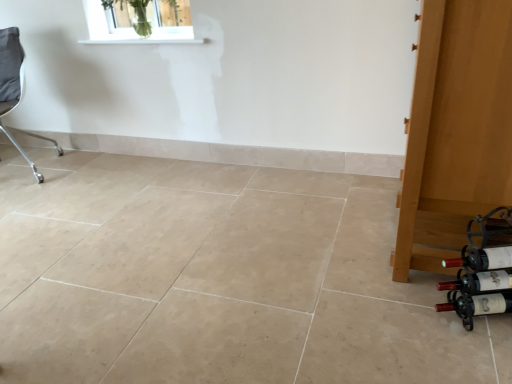
Image resolution: width=512 pixels, height=384 pixels. Describe the element at coordinates (455, 131) in the screenshot. I see `wooden door at right` at that location.

The image size is (512, 384). What do you see at coordinates (480, 281) in the screenshot?
I see `matte glass wine bottle at lower right, the 3th wine bottle in the top-to-bottom sequence` at bounding box center [480, 281].

The width and height of the screenshot is (512, 384). Find the location of `gray fabric chair at left`. gray fabric chair at left is located at coordinates (16, 91).

What do you see at coordinates (16, 91) in the screenshot? I see `gray fabric chair at left` at bounding box center [16, 91].

What do you see at coordinates (482, 258) in the screenshot? The height and width of the screenshot is (384, 512). I see `matte black wine bottle at lower right, which is the 4th wine bottle in bottom-to-top order` at bounding box center [482, 258].

What is the approximate height of white smooth window sill at upper center?

The height of white smooth window sill at upper center is 3.47 centimeters.

I want to click on white smooth window sill at upper center, so click(x=144, y=41).

Measure the distance between matte glass wine bottle at lower right, the 3th wine bottle from the bottom, and camera.

matte glass wine bottle at lower right, the 3th wine bottle from the bottom, and camera are 4.34 feet apart.

The height and width of the screenshot is (384, 512). What do you see at coordinates (477, 304) in the screenshot?
I see `matte glass wine bottle at lower right, which is counted as the first wine bottle, starting from the bottom` at bounding box center [477, 304].

At what (x,y) coordinates should I click in order to perform the action: click on clear glass vase at upper center. Please return your answer as a coordinate pair (x, y). The height and width of the screenshot is (384, 512). Looking at the image, I should click on (139, 23).

Identify the location of wooden door at right. Image resolution: width=512 pixels, height=384 pixels. 455,131.

Which of these two, matte glass wine bottle at lower right, the 4th wine bottle in the top-to-bottom sequence, or white smooth window sill at upper center, stands taller?

matte glass wine bottle at lower right, the 4th wine bottle in the top-to-bottom sequence.

Is matte glass wine bottle at lower right, the 4th wine bottle in the top-to-bottom sequence, positioned in front of white smooth window sill at upper center?

Yes, matte glass wine bottle at lower right, the 4th wine bottle in the top-to-bottom sequence, is in front of white smooth window sill at upper center.

Does matte glass wine bottle at lower right, which is counted as the first wine bottle, starting from the bottom, have a larger size compared to white smooth window sill at upper center?

Actually, matte glass wine bottle at lower right, which is counted as the first wine bottle, starting from the bottom, might be smaller than white smooth window sill at upper center.

From the image's perspective, is matte glass wine bottle at lower right, which is counted as the first wine bottle, starting from the bottom, on white smooth window sill at upper center?

No.

Is white smooth window sill at upper center beside matte black wine bottle at lower right, which is the 4th wine bottle in bottom-to-top order?

No.

Looking at this image, which object is further away from the camera, white smooth window sill at upper center or matte black wine bottle at lower right, which is the first wine bottle from top to bottom?

Positioned behind is white smooth window sill at upper center.

Which of these two, white smooth window sill at upper center or matte black wine bottle at lower right, which is the first wine bottle from top to bottom, is bigger?

With larger size is white smooth window sill at upper center.

What are the coordinates of `the 2nd wine bottle counting from the right of the white smooth window sill at upper center` in the screenshot? It's located at (482, 258).

Which is behind, matte glass wine bottle at lower right, the 2th wine bottle positioned from the bottom, or gray fabric chair at left?

gray fabric chair at left is more distant.

Is matte glass wine bottle at lower right, the 3th wine bottle in the top-to-bottom sequence, aimed at gray fabric chair at left?

No, matte glass wine bottle at lower right, the 3th wine bottle in the top-to-bottom sequence, does not turn towards gray fabric chair at left.

In the image, is matte glass wine bottle at lower right, the 3th wine bottle in the top-to-bottom sequence, on the left side or the right side of gray fabric chair at left?

Result: From the image, it's evident that matte glass wine bottle at lower right, the 3th wine bottle in the top-to-bottom sequence, is to the right of gray fabric chair at left.

Between matte glass wine bottle at lower right, the 2th wine bottle positioned from the bottom, and gray fabric chair at left, which one has more height?

gray fabric chair at left.

Could you tell me if gray fabric chair at left is turned towards matte glass wine bottle at lower right, the 3th wine bottle from the bottom?

No, gray fabric chair at left is not facing towards matte glass wine bottle at lower right, the 3th wine bottle from the bottom.

From the image's perspective, does gray fabric chair at left appear higher than matte glass wine bottle at lower right, which is the second wine bottle in top-to-bottom order?

Indeed, from the image's perspective, gray fabric chair at left is shown above matte glass wine bottle at lower right, which is the second wine bottle in top-to-bottom order.

How far apart are gray fabric chair at left and matte glass wine bottle at lower right, which is the second wine bottle in top-to-bottom order?

gray fabric chair at left is 9.50 feet away from matte glass wine bottle at lower right, which is the second wine bottle in top-to-bottom order.

From a real-world perspective, which object stands above the other?

gray fabric chair at left.

Is matte glass wine bottle at lower right, the 3th wine bottle from the bottom, aimed at gray fabric chair at left?

No, matte glass wine bottle at lower right, the 3th wine bottle from the bottom, is not oriented towards gray fabric chair at left.

This screenshot has height=384, width=512. What are the coordinates of `chair that is above the matte glass wine bottle at lower right, the 3th wine bottle from the bottom (from a real-world perspective)` in the screenshot? It's located at (16, 91).

Considering the positions of objects matte glass wine bottle at lower right, the 3th wine bottle from the bottom, and gray fabric chair at left in the image provided, who is more to the right, matte glass wine bottle at lower right, the 3th wine bottle from the bottom, or gray fabric chair at left?

matte glass wine bottle at lower right, the 3th wine bottle from the bottom.

In terms of width, does matte glass wine bottle at lower right, which is the second wine bottle in top-to-bottom order, look wider or thinner when compared to gray fabric chair at left?

matte glass wine bottle at lower right, which is the second wine bottle in top-to-bottom order, is thinner than gray fabric chair at left.

Looking at this image, can you confirm if matte glass wine bottle at lower right, which is counted as the first wine bottle, starting from the bottom, is smaller than gray fabric chair at left?

Yes, matte glass wine bottle at lower right, which is counted as the first wine bottle, starting from the bottom, is smaller than gray fabric chair at left.

From a real-world perspective, between matte glass wine bottle at lower right, which is counted as the first wine bottle, starting from the bottom, and gray fabric chair at left, who is vertically higher?

gray fabric chair at left.

Considering the sizes of objects matte glass wine bottle at lower right, which is counted as the first wine bottle, starting from the bottom, and gray fabric chair at left in the image provided, who is taller, matte glass wine bottle at lower right, which is counted as the first wine bottle, starting from the bottom, or gray fabric chair at left?

gray fabric chair at left.

Which object is further away from the camera, matte glass wine bottle at lower right, which is counted as the first wine bottle, starting from the bottom, or gray fabric chair at left?

gray fabric chair at left is behind.

Is clear glass vase at upper center turned away from matte glass wine bottle at lower right, the 4th wine bottle in the top-to-bottom sequence?

clear glass vase at upper center is not turned away from matte glass wine bottle at lower right, the 4th wine bottle in the top-to-bottom sequence.

From the picture: In the image, is clear glass vase at upper center positioned in front of or behind matte glass wine bottle at lower right, which is counted as the first wine bottle, starting from the bottom?

clear glass vase at upper center is behind matte glass wine bottle at lower right, which is counted as the first wine bottle, starting from the bottom.

In order to click on wine bottle that is the 4th object located below the clear glass vase at upper center (from the image's perspective) in this screenshot , I will do `click(477, 304)`.

Which of these two, clear glass vase at upper center or matte glass wine bottle at lower right, the 4th wine bottle in the top-to-bottom sequence, is smaller?

With smaller size is matte glass wine bottle at lower right, the 4th wine bottle in the top-to-bottom sequence.

You are a GUI agent. You are given a task and a screenshot of the screen. Output one action in this format:
    pyautogui.click(x=<x>, y=<y>)
    Task: Click on the 3rd wine bottle counting from the right side of the white smooth window sill at upper center
    The width and height of the screenshot is (512, 384).
    Given the screenshot: What is the action you would take?
    pyautogui.click(x=477, y=304)

At what (x,y) coordinates should I click in order to perform the action: click on wine bottle that is the 3rd one when counting forward from the white smooth window sill at upper center. Please return your answer as a coordinate pair (x, y). Looking at the image, I should click on (482, 258).

Estimate the real-world distances between objects in this image. Which object is further from matte glass wine bottle at lower right, which is counted as the first wine bottle, starting from the bottom, matte black wine bottle at lower right, which is the 4th wine bottle in bottom-to-top order, or matte glass wine bottle at lower right, the 2th wine bottle positioned from the bottom?

matte black wine bottle at lower right, which is the 4th wine bottle in bottom-to-top order, is further to matte glass wine bottle at lower right, which is counted as the first wine bottle, starting from the bottom.

Which object lies nearer to the anchor point matte black wine bottle at lower right, which is the first wine bottle from top to bottom, matte glass wine bottle at lower right, which is counted as the first wine bottle, starting from the bottom, or matte glass wine bottle at lower right, the 3th wine bottle in the top-to-bottom sequence?

matte glass wine bottle at lower right, the 3th wine bottle in the top-to-bottom sequence, is closer to matte black wine bottle at lower right, which is the first wine bottle from top to bottom.

Considering their positions, is wooden door at right positioned closer to matte glass wine bottle at lower right, the 3th wine bottle from the bottom, than matte black wine bottle at lower right, which is the 4th wine bottle in bottom-to-top order?

Based on the image, matte black wine bottle at lower right, which is the 4th wine bottle in bottom-to-top order, appears to be nearer to matte glass wine bottle at lower right, the 3th wine bottle from the bottom.

When comparing their distances from matte glass wine bottle at lower right, the 3th wine bottle in the top-to-bottom sequence, does matte glass wine bottle at lower right, which is counted as the first wine bottle, starting from the bottom, or white smooth window sill at upper center seem further?

Based on the image, white smooth window sill at upper center appears to be further to matte glass wine bottle at lower right, the 3th wine bottle in the top-to-bottom sequence.

Based on their spatial positions, is gray fabric chair at left or matte glass wine bottle at lower right, which is the second wine bottle in top-to-bottom order, closer to white smooth window sill at upper center?

Among the two, gray fabric chair at left is located nearer to white smooth window sill at upper center.

When comparing their distances from matte glass wine bottle at lower right, the 3th wine bottle in the top-to-bottom sequence, does gray fabric chair at left or matte black wine bottle at lower right, which is the first wine bottle from top to bottom, seem closer?

The object closer to matte glass wine bottle at lower right, the 3th wine bottle in the top-to-bottom sequence, is matte black wine bottle at lower right, which is the first wine bottle from top to bottom.

From the picture: Considering their positions, is clear glass vase at upper center positioned further to matte black wine bottle at lower right, which is the 4th wine bottle in bottom-to-top order, than wooden door at right?

Based on the image, clear glass vase at upper center appears to be further to matte black wine bottle at lower right, which is the 4th wine bottle in bottom-to-top order.

Considering their positions, is matte black wine bottle at lower right, which is the first wine bottle from top to bottom, positioned further to matte glass wine bottle at lower right, which is counted as the first wine bottle, starting from the bottom, than matte glass wine bottle at lower right, which is the second wine bottle in top-to-bottom order?

matte black wine bottle at lower right, which is the first wine bottle from top to bottom, is positioned further to the anchor matte glass wine bottle at lower right, which is counted as the first wine bottle, starting from the bottom.

Image resolution: width=512 pixels, height=384 pixels. Find the location of `window situated between gray fabric chair at left and matte black wine bottle at lower right, which is the 4th wine bottle in bottom-to-top order, from left to right`. window situated between gray fabric chair at left and matte black wine bottle at lower right, which is the 4th wine bottle in bottom-to-top order, from left to right is located at coordinates (x=139, y=23).

Locate an element on the screen. This screenshot has width=512, height=384. window situated between gray fabric chair at left and matte glass wine bottle at lower right, the 3th wine bottle from the bottom, from left to right is located at coordinates click(x=139, y=23).

At what (x,y) coordinates should I click in order to perform the action: click on window sill between clear glass vase at upper center and matte black wine bottle at lower right, which is the first wine bottle from top to bottom, from left to right. Please return your answer as a coordinate pair (x, y). Looking at the image, I should click on (144, 41).

Locate an element on the screen. The height and width of the screenshot is (384, 512). wine bottle between white smooth window sill at upper center and matte black wine bottle at lower right, which is the first wine bottle from top to bottom, from left to right is located at coordinates (480, 281).